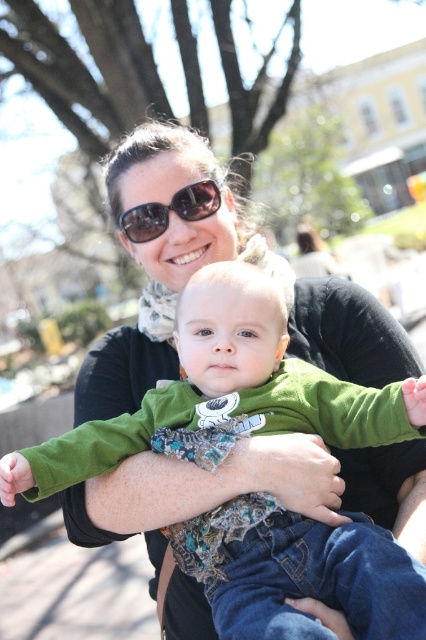
From the picture: You are a photographer trying to capture a closeup of the baby while ensuring the woman is still visible in the frame. Given their positions, can you position yourself so that both the green soft fabric baby at center and the black reflective sunglasses at upper center are in the shot without any overlap?

The green soft fabric baby at center is positioned on the right side of black reflective sunglasses at upper center, so yes, you can position yourself to capture both without overlap by framing the shot to include both the right side of the baby and the left side of the sunglasses.

Looking at this image, you are a photographer trying to capture a closeup of the baby in the image. The baby is at the center, and there is a point marked at coordinate [224,394]. Where exactly is the point located in relation to the baby?

The point at [224,394] is located at the green soft fabric baby at center.